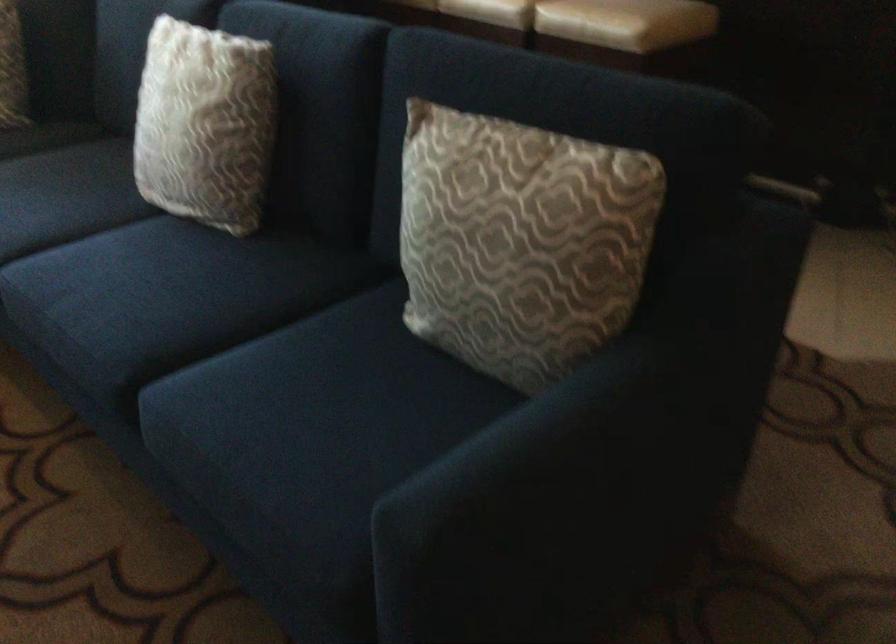
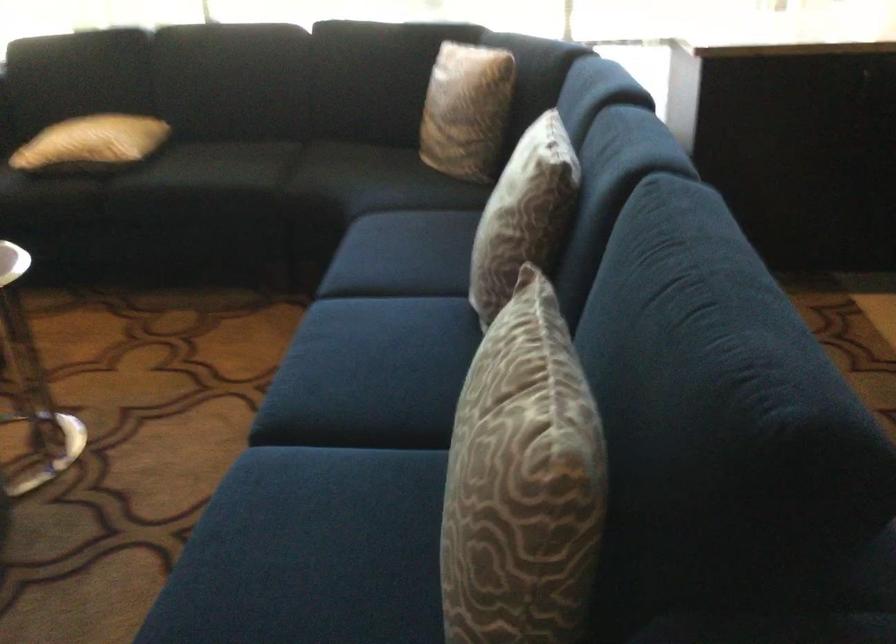
The point at (618,198) is marked in the first image. Where is the corresponding point in the second image?

(522, 482)